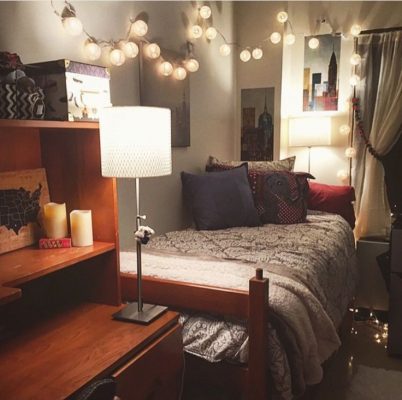
Image resolution: width=402 pixels, height=400 pixels. Find the location of `painting`. painting is located at coordinates (311, 73).